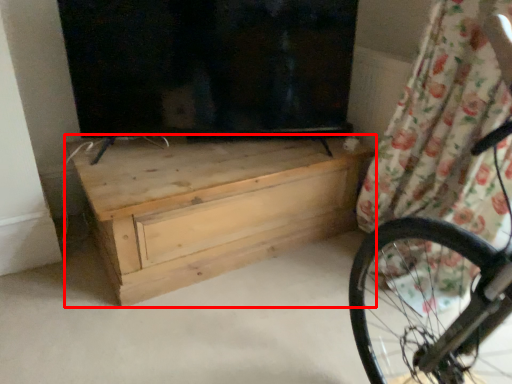
Question: From the image's perspective, where is chest of drawers (annotated by the red box) located relative to curtain?

Choices:
 (A) above
 (B) below

Answer: (B)